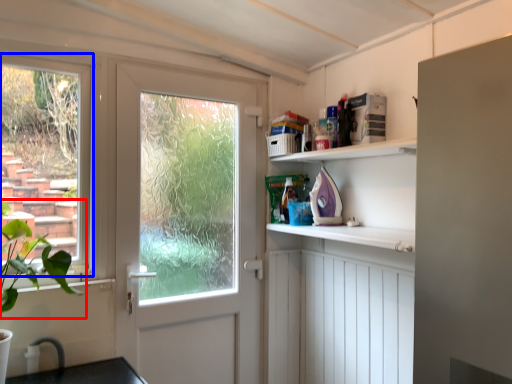
Question: Which object is closer to the camera taking this photo, plant (highlighted by a red box) or window (highlighted by a blue box)?

Choices:
 (A) plant
 (B) window

Answer: (A)